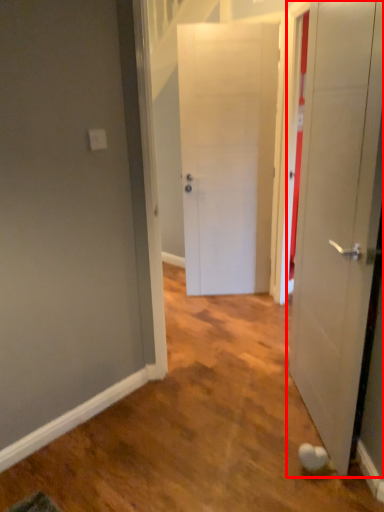
Question: In this image, where is door (annotated by the red box) located relative to door?

Choices:
 (A) left
 (B) right

Answer: (B)